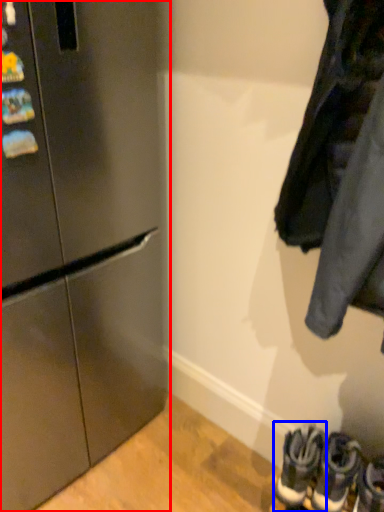
Question: Which object is closer to the camera taking this photo, refrigerator (highlighted by a red box) or footwear (highlighted by a blue box)?

Choices:
 (A) refrigerator
 (B) footwear

Answer: (A)